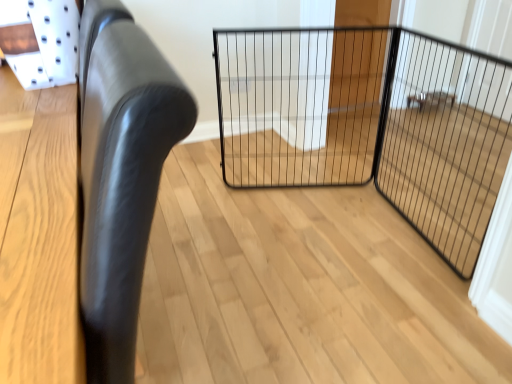
You are a GUI agent. You are given a task and a screenshot of the screen. Output one action in this format:
    pyautogui.click(x=<x>, y=<y>)
    Task: Click on the vacant space underneath black wire mesh screen door at center (from a real-world perspective)
    
    Given the screenshot: What is the action you would take?
    pyautogui.click(x=422, y=235)